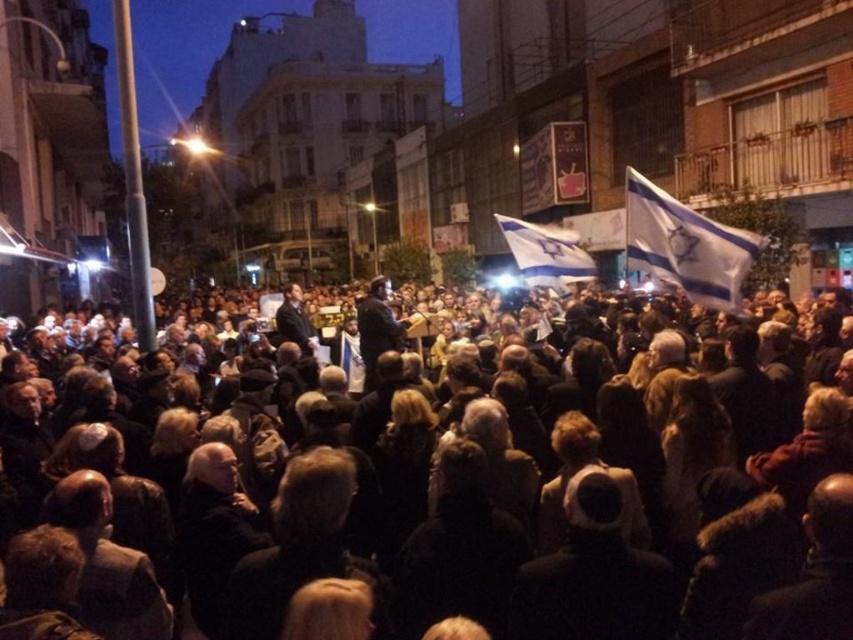
Can you confirm if black fabric crowd at center is thinner than white fabric flag at center?

Incorrect, black fabric crowd at center's width is not less than white fabric flag at center's.

How distant is black fabric crowd at center from white fabric flag at center?

A distance of 31.50 feet exists between black fabric crowd at center and white fabric flag at center.

The image size is (853, 640). What do you see at coordinates (426, 508) in the screenshot?
I see `black fabric crowd at center` at bounding box center [426, 508].

In order to click on black fabric crowd at center in this screenshot , I will do `click(426, 508)`.

Which of these two, black fabric crowd at center or white fabric flag at upper right, stands shorter?

Standing shorter between the two is white fabric flag at upper right.

Between black fabric crowd at center and white fabric flag at upper right, which one is positioned lower?

Positioned lower is black fabric crowd at center.

The height and width of the screenshot is (640, 853). Find the location of `black fabric crowd at center`. black fabric crowd at center is located at coordinates (426, 508).

Does white fabric flag at upper right have a greater width compared to white fabric flag at center?

In fact, white fabric flag at upper right might be narrower than white fabric flag at center.

Is point (643, 193) more distant than point (531, 253)?

No.

Is point (694, 212) closer to viewer compared to point (521, 234)?

Yes, it is.

I want to click on white fabric flag at upper right, so click(x=686, y=244).